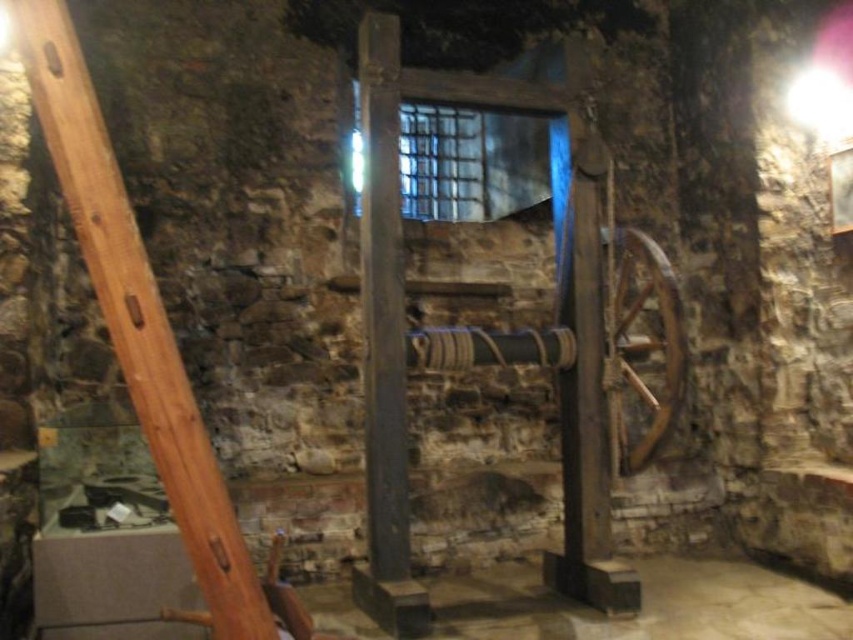
Question: Is smooth wooden pole at left bigger than smooth dark wood pillar at center?

Choices:
 (A) yes
 (B) no

Answer: (B)

Question: Which point appears farthest from the camera in this image?

Choices:
 (A) (222, 522)
 (B) (402, 628)

Answer: (B)

Question: Among these objects, which one is nearest to the camera?

Choices:
 (A) smooth wooden pole at left
 (B) smooth dark wood pillar at center

Answer: (A)

Question: Is smooth wooden pole at left bigger than smooth dark wood pillar at center?

Choices:
 (A) no
 (B) yes

Answer: (A)

Question: Can you confirm if smooth wooden pole at left is bigger than smooth dark wood pillar at center?

Choices:
 (A) no
 (B) yes

Answer: (A)